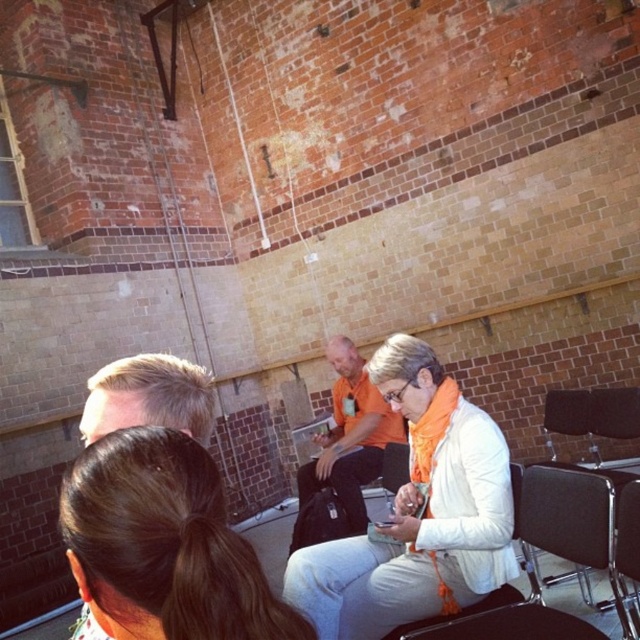
Question: Is orange cotton shirt at center below blonde hair at left?

Choices:
 (A) yes
 (B) no

Answer: (A)

Question: Which point is farther to the camera?

Choices:
 (A) (632, 502)
 (B) (360, 490)

Answer: (B)

Question: Is brown hair at center closer to camera compared to black leather chair at center?

Choices:
 (A) yes
 (B) no

Answer: (A)

Question: Does orange fabric shirt at center come in front of blonde hair at left?

Choices:
 (A) no
 (B) yes

Answer: (A)

Question: Which object appears closest to the camera in this image?

Choices:
 (A) brown hair at center
 (B) orange cotton shirt at center
 (C) black leather chair at center

Answer: (A)

Question: Which point appears closest to the camera in this image?

Choices:
 (A) (109, 513)
 (B) (401, 388)
 (C) (339, 433)

Answer: (A)